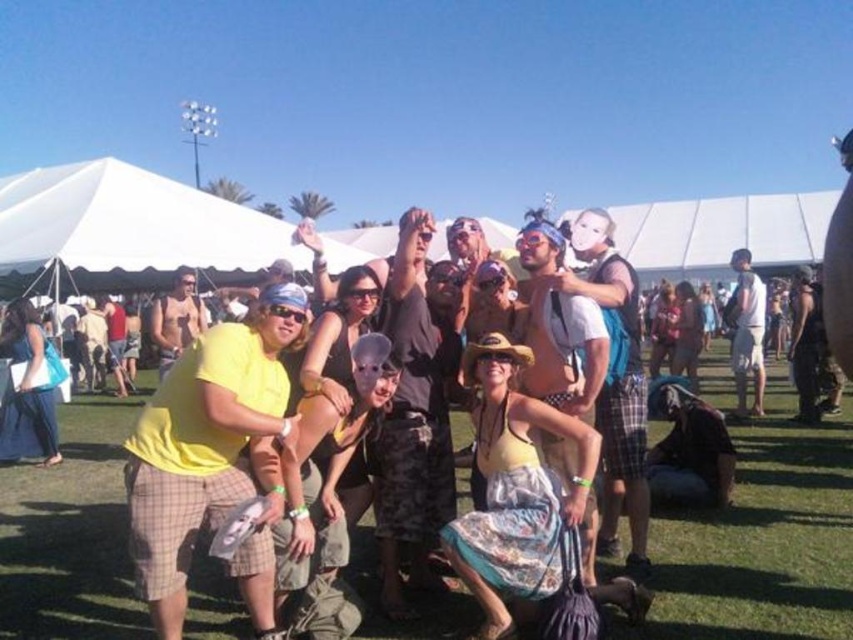
Who is higher up, green grass at center or yellow t-shirt at center?

Positioned higher is yellow t-shirt at center.

Does green grass at center appear on the left side of yellow t-shirt at center?

Incorrect, green grass at center is not on the left side of yellow t-shirt at center.

Describe the element at coordinates (763, 540) in the screenshot. I see `green grass at center` at that location.

This screenshot has width=853, height=640. I want to click on green grass at center, so click(x=763, y=540).